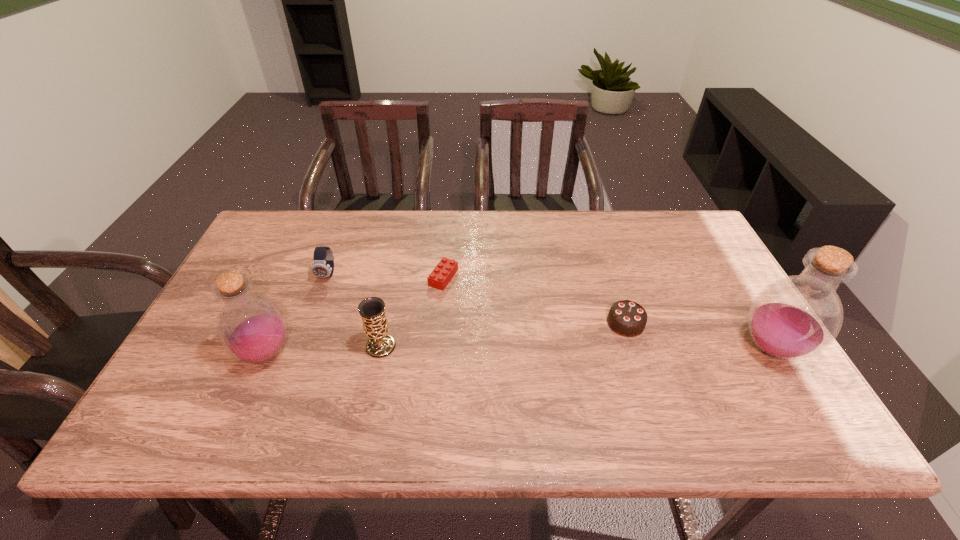
Locate an element on the screen. Image resolution: width=960 pixels, height=540 pixels. the shorter bottle is located at coordinates (252, 328).

The image size is (960, 540). Identify the location of the left bottle. (252, 328).

Locate an element on the screen. The height and width of the screenshot is (540, 960). the taller bottle is located at coordinates (796, 317).

Where is `the rightmost object`? The height and width of the screenshot is (540, 960). the rightmost object is located at coordinates (796, 317).

At what (x,y) coordinates should I click in order to perform the action: click on Lego. Please return your answer as a coordinate pair (x, y). The height and width of the screenshot is (540, 960). Looking at the image, I should click on (439, 278).

Where is `the shortest object`? This screenshot has width=960, height=540. the shortest object is located at coordinates (439, 278).

The width and height of the screenshot is (960, 540). In order to click on watch in this screenshot , I will do `click(323, 259)`.

Locate an element on the screen. Image resolution: width=960 pixels, height=540 pixels. the second object from right to left is located at coordinates (626, 318).

You are a GUI agent. You are given a task and a screenshot of the screen. Output one action in this format:
    pyautogui.click(x=<x>, y=<y>)
    Task: Click on the chocolate cake
    Image resolution: width=960 pixels, height=540 pixels.
    Given the screenshot: What is the action you would take?
    pyautogui.click(x=626, y=318)

Locate an element on the screen. the fourth object from right to left is located at coordinates (372, 310).